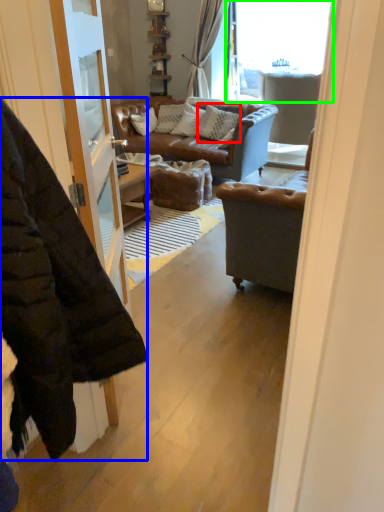
Question: Which object is positioned closest to pillow (highlighted by a red box)? Select from jacket (highlighted by a blue box) and window (highlighted by a green box).

Choices:
 (A) jacket
 (B) window

Answer: (B)